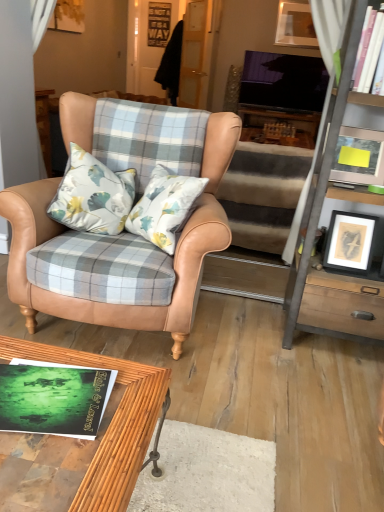
Question: From a real-world perspective, relative to black matte picture frame at right, the third picture frame in the top-to-bottom sequence, is white carpet at lower center vertically above or below?

Choices:
 (A) below
 (B) above

Answer: (A)

Question: From the image's perspective, is white carpet at lower center above or below black matte picture frame at right, marked as the 2th picture frame in a back-to-front arrangement?

Choices:
 (A) below
 (B) above

Answer: (A)

Question: Estimate the real-world distances between objects in this image. Which object is closer to the beige carpeted stairs at center?

Choices:
 (A) metallic gray cabinet at right
 (B) green matte book at lower left
 (C) matte wooden picture frame at upper right, acting as the 1th picture frame starting from the right
 (D) matte gray picture frame at upper right, the 3th picture frame positioned from the right
 (E) tan leather chair at center

Answer: (A)

Question: Estimate the real-world distances between objects in this image. Which object is closer to the white glossy bookshelf at upper right?

Choices:
 (A) beige carpeted stairs at center
 (B) green matte book at lower left
 (C) bamboo wood coffee table at lower center
 (D) matte wooden picture frame at upper right, acting as the 1th picture frame starting from the top
 (E) metallic gray cabinet at right

Answer: (E)